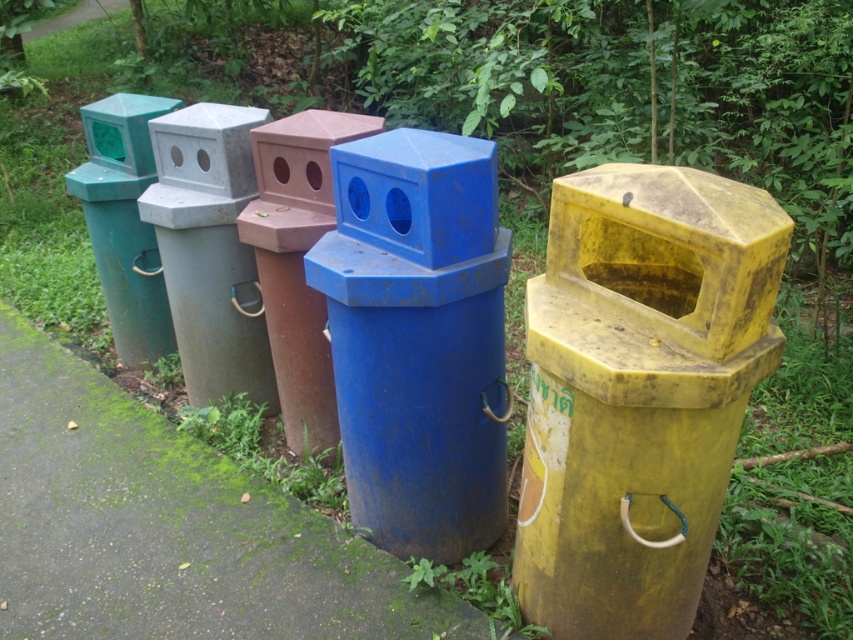
You are a park maintenance worker who needs to place a new, smaller trash can between the yellow matte trash can at center and the blue matte trash can at center. Based on their sizes, which existing trash can should the new one be placed next to?

The yellow matte trash can at center is not as tall as the blue matte trash can at center, so the new smaller trash can should be placed next to the yellow matte trash can at center since it is shorter and the new one is also smaller.

You are a park maintenance worker who needs to place a new sign between the yellow matte trash can at center and the blue matte trash can at center. According to the scene description, where should you position the sign relative to these two trash cans?

The yellow matte trash can at center is located below the blue matte trash can at center, so you should place the sign between them such that it is above the yellow matte trash can at center and below the blue matte trash can at center.